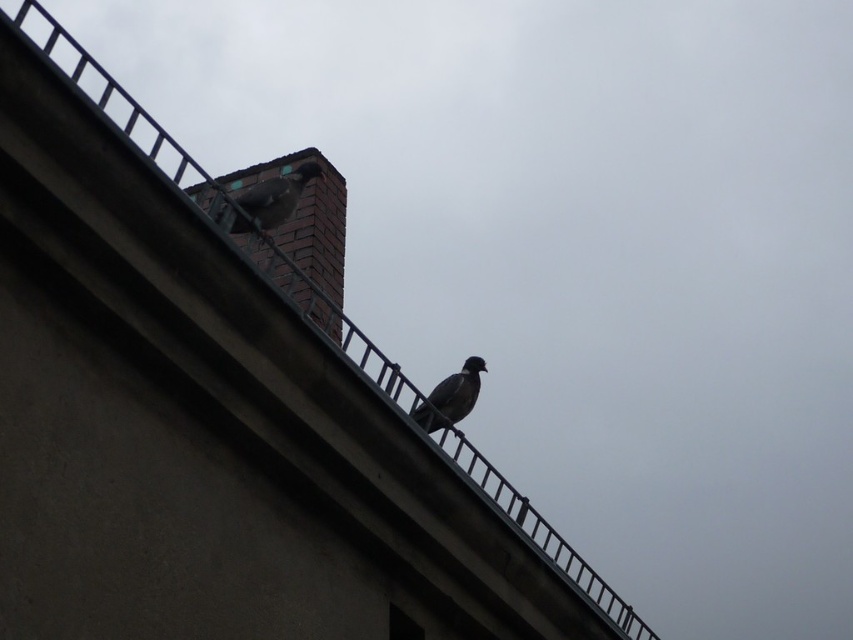
You are a photographer trying to capture both pigeons in the image. Since the gray matte pigeon at upper center is larger than the gray matte pigeon at center, which one is closer to the camera?

The gray matte pigeon at upper center is closer to the camera because it has a larger size compared to the gray matte pigeon at center.

You are standing on the roof and see two pigeons. One is the gray matte pigeon at upper center and the other is the gray matte pigeon at center. Which pigeon is positioned to the left when looking from the front of the roof?

The gray matte pigeon at upper center is positioned to the left of the gray matte pigeon at center.